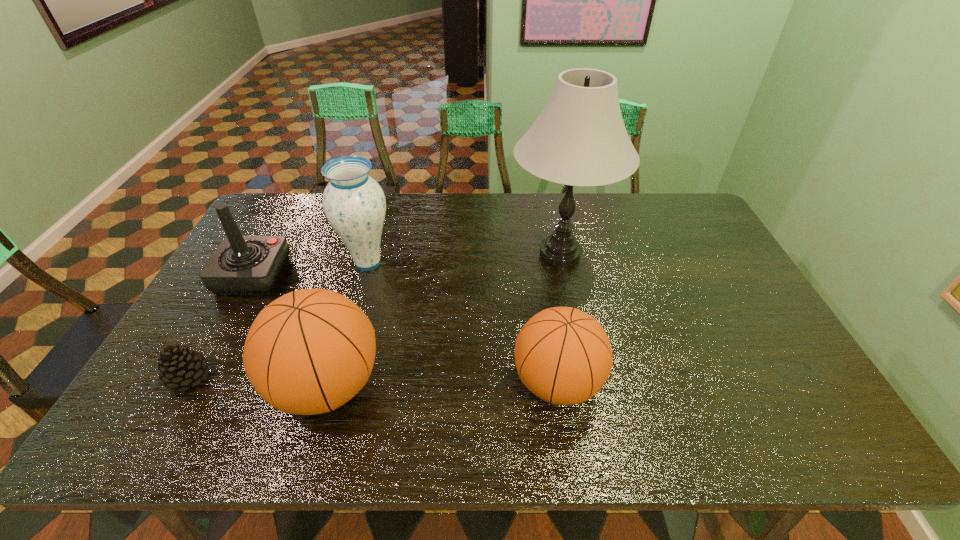
The image size is (960, 540). Find the location of `vacant region at the right edge of the desktop`. vacant region at the right edge of the desktop is located at coordinates (766, 339).

Locate an element on the screen. vacant space at the near right corner of the desktop is located at coordinates (759, 392).

Image resolution: width=960 pixels, height=540 pixels. I want to click on vacant area that lies between the joystick and the pinecone, so click(221, 327).

At what (x,y) coordinates should I click in order to perform the action: click on free space between the shortest object and the joystick. Please return your answer as a coordinate pair (x, y). The height and width of the screenshot is (540, 960). Looking at the image, I should click on (221, 327).

Where is `vacant space that is in between the vase and the tallest object`? This screenshot has height=540, width=960. vacant space that is in between the vase and the tallest object is located at coordinates (464, 259).

Locate an element on the screen. vacant point located between the lamp and the vase is located at coordinates (464, 259).

Where is `free space that is in between the fifth shortest object and the shorter basketball`? free space that is in between the fifth shortest object and the shorter basketball is located at coordinates (463, 323).

Where is `empty space that is in between the second shortest object and the taller basketball`? Image resolution: width=960 pixels, height=540 pixels. empty space that is in between the second shortest object and the taller basketball is located at coordinates (442, 384).

This screenshot has height=540, width=960. Identify the location of free space between the pinecone and the second shortest object. (372, 380).

The image size is (960, 540). What are the coordinates of `vacant point located between the shorter basketball and the left basketball` in the screenshot? It's located at (442, 384).